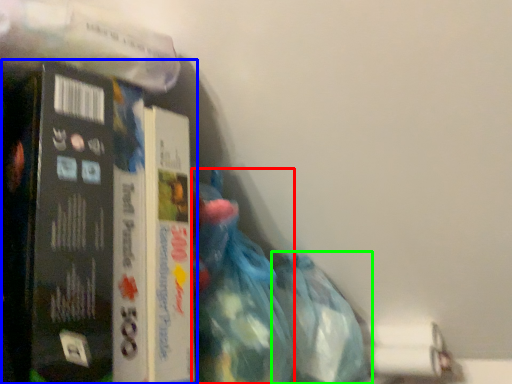
Question: Which object is positioned farthest from waste (highlighted by a red box)? Select from book (highlighted by a blue box) and plastic bag (highlighted by a green box).

Choices:
 (A) book
 (B) plastic bag

Answer: (A)